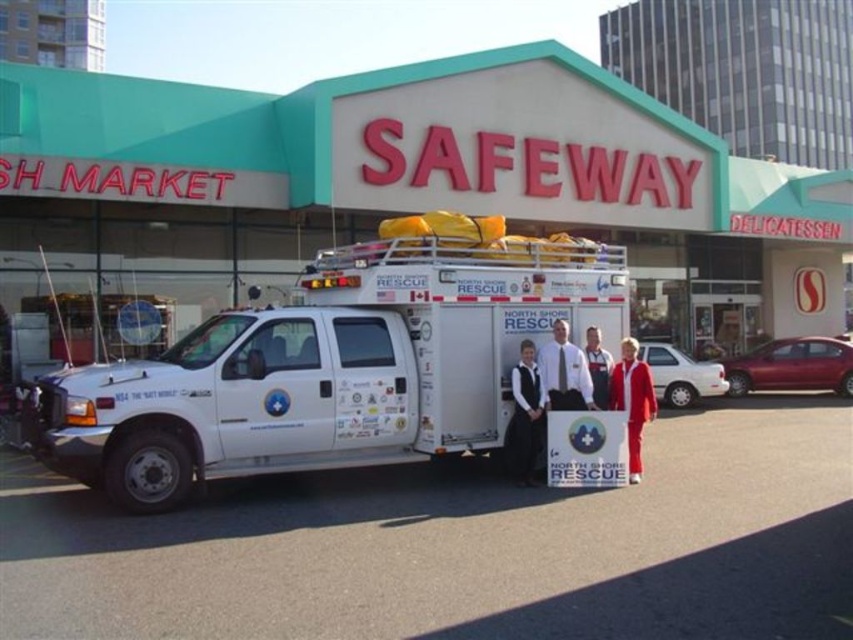
Question: Which object appears closest to the camera in this image?

Choices:
 (A) matte red suit at center
 (B) black fabric dress at center

Answer: (A)

Question: In this image, where is black fabric dress at center located relative to white shirt at center?

Choices:
 (A) below
 (B) above

Answer: (A)

Question: Where is black fabric dress at center located in relation to white fabric shirt at center in the image?

Choices:
 (A) above
 (B) below

Answer: (B)

Question: Which of the following is the farthest from the observer?

Choices:
 (A) (695, 381)
 (B) (579, 358)
 (C) (523, 467)

Answer: (A)

Question: Does white matte truck at center appear on the left side of white fabric shirt at center?

Choices:
 (A) yes
 (B) no

Answer: (A)

Question: Which object is the closest to the white matte van at center?

Choices:
 (A) matte red suit at center
 (B) white plastic truck at center

Answer: (B)